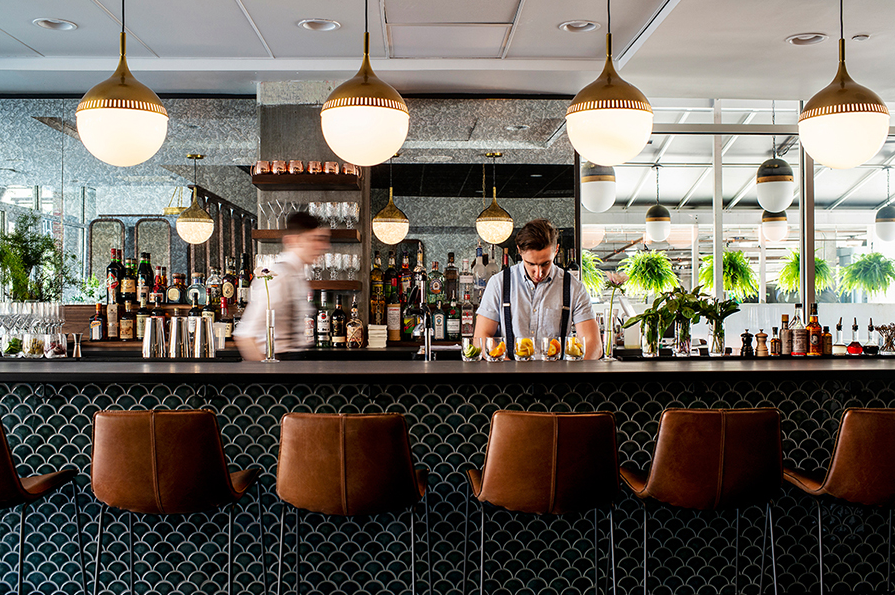
I want to click on hanging plants, so click(x=645, y=261), click(x=740, y=281), click(x=783, y=274), click(x=868, y=274).